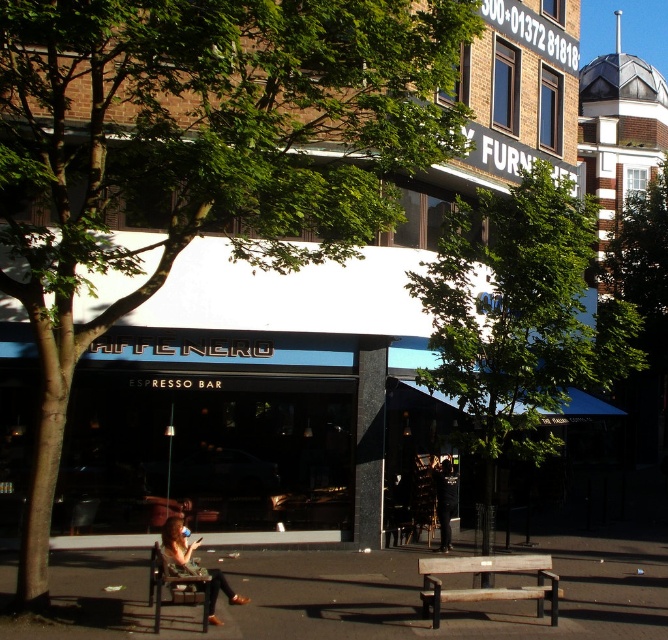
Question: Which point is closer to the camera taking this photo?

Choices:
 (A) (178, 561)
 (B) (53, 348)
 (C) (172, 580)

Answer: (C)

Question: Is wooden bench at center bigger than wooden bench at lower left?

Choices:
 (A) no
 (B) yes

Answer: (B)

Question: Which is farther from the wooden bench at lower left?

Choices:
 (A) matte brown hair at lower center
 (B) wooden bench at center
 (C) green leafy tree at upper left

Answer: (C)

Question: Does green leafy tree at upper left have a larger size compared to wooden bench at lower left?

Choices:
 (A) no
 (B) yes

Answer: (A)

Question: Can you confirm if green leafy tree at upper left is thinner than wooden bench at lower left?

Choices:
 (A) yes
 (B) no

Answer: (A)

Question: Which point is closer to the camera?

Choices:
 (A) matte brown hair at lower center
 (B) wooden bench at center
 (C) green leafy tree at center
 (D) wooden bench at lower left

Answer: (D)